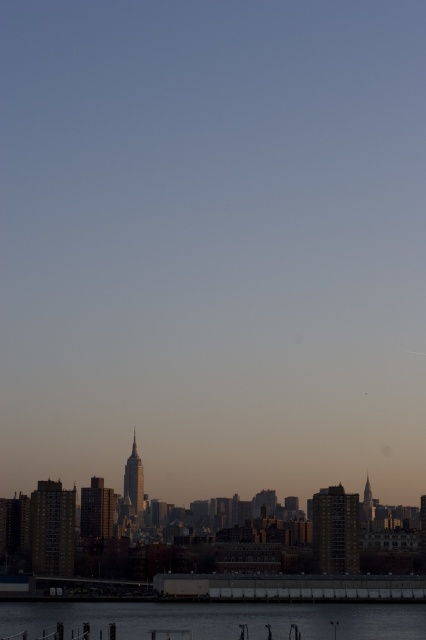
Who is shorter, clear water at lower center or concrete dock at lower center?

With less height is concrete dock at lower center.

Is clear water at lower center shorter than concrete dock at lower center?

In fact, clear water at lower center may be taller than concrete dock at lower center.

Locate an element on the screen. This screenshot has width=426, height=640. clear water at lower center is located at coordinates (219, 618).